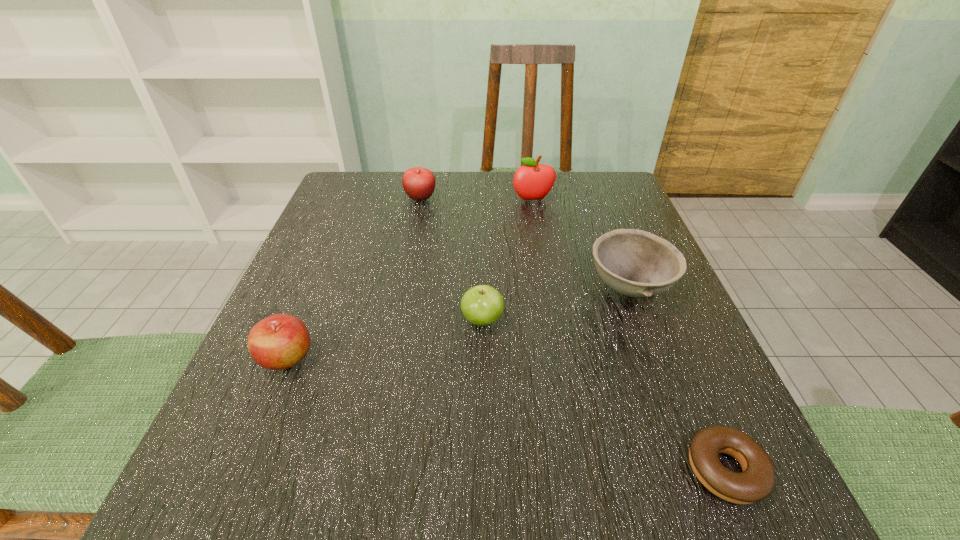
The height and width of the screenshot is (540, 960). I want to click on free spot between the nearest object and the bowl, so click(x=678, y=379).

You are a GUI agent. You are given a task and a screenshot of the screen. Output one action in this format:
    pyautogui.click(x=<x>, y=<y>)
    Task: Click on the blank region between the shortest object and the bowl
    The width and height of the screenshot is (960, 540).
    Given the screenshot: What is the action you would take?
    pyautogui.click(x=678, y=379)

This screenshot has width=960, height=540. In order to click on free spot between the nearest object and the rightmost apple in this screenshot , I will do click(629, 335).

This screenshot has height=540, width=960. I want to click on free point between the second object from left to right and the nearest apple, so click(x=354, y=279).

This screenshot has width=960, height=540. I want to click on free space between the leftmost apple and the tallest object, so click(410, 279).

The width and height of the screenshot is (960, 540). Identify the location of unoccupied area between the shortest object and the fourth object from left to right. (x=629, y=335).

Where is `free space between the leftmost apple and the rightmost apple`? This screenshot has height=540, width=960. free space between the leftmost apple and the rightmost apple is located at coordinates (410, 279).

Identify which object is the third nearest to the second apple from left to right. Please provide its 2D coordinates. Your answer should be formatted as a tuple, i.e. [(x, y)], where the tuple contains the x and y coordinates of a point satisfying the conditions above.

[(635, 263)]

Locate an element on the screen. The width and height of the screenshot is (960, 540). object that can be found as the second closest to the tallest object is located at coordinates (635, 263).

Select which apple appears as the third closest to the shortest object. Please provide its 2D coordinates. Your answer should be formatted as a tuple, i.e. [(x, y)], where the tuple contains the x and y coordinates of a point satisfying the conditions above.

[(532, 181)]